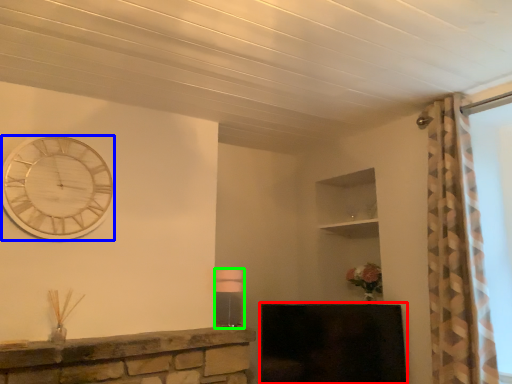
Question: Which object is positioned closest to fireplace (highlighted by a red box)? Select from wall clock (highlighted by a blue box) and lamp (highlighted by a green box).

Choices:
 (A) wall clock
 (B) lamp

Answer: (B)